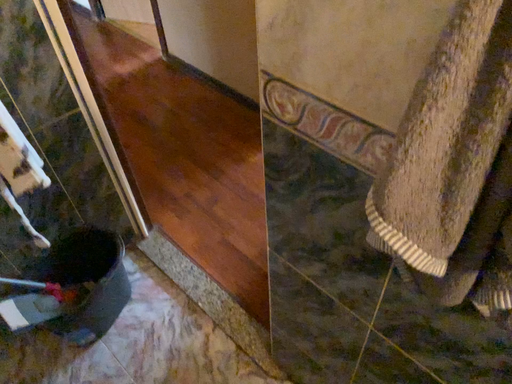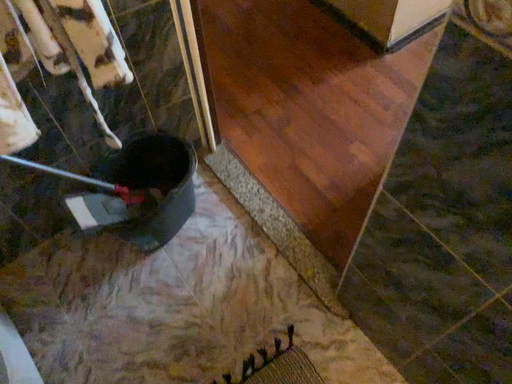
Question: Which way did the camera rotate in the video?

Choices:
 (A) rotated downward
 (B) rotated upward

Answer: (A)